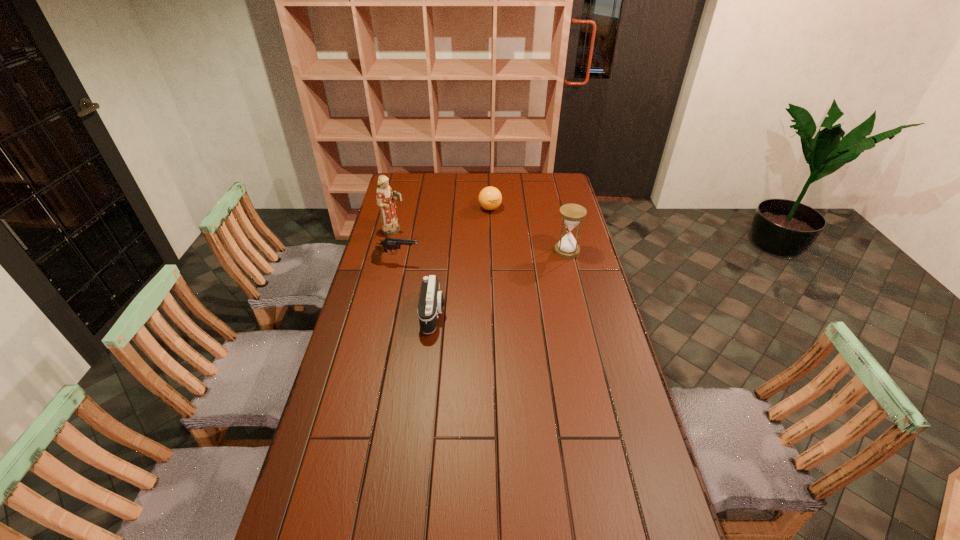
Where is `gun that is at the left edge`? The width and height of the screenshot is (960, 540). gun that is at the left edge is located at coordinates (389, 243).

Locate an element on the screen. The width and height of the screenshot is (960, 540). figurine located in the left edge section of the desktop is located at coordinates (385, 199).

Where is `object at the right edge`? This screenshot has height=540, width=960. object at the right edge is located at coordinates (572, 214).

Locate an element on the screen. This screenshot has width=960, height=540. free space at the far edge of the desktop is located at coordinates (527, 190).

The height and width of the screenshot is (540, 960). In the image, there is a desktop. Find the location of `blank space at the near edge`. blank space at the near edge is located at coordinates (447, 522).

Locate an element on the screen. vacant space at the left edge of the desktop is located at coordinates (396, 255).

Identify the location of free space at the right edge of the desktop. The height and width of the screenshot is (540, 960). (576, 285).

Where is `vacant position at the far left corner of the desktop`? Image resolution: width=960 pixels, height=540 pixels. vacant position at the far left corner of the desktop is located at coordinates (408, 191).

At what (x,y) coordinates should I click in order to perform the action: click on vacant region at the far right corner of the desktop. Please return your answer as a coordinate pair (x, y). Looking at the image, I should click on (543, 179).

The image size is (960, 540). What are the coordinates of `free space between the farthest object and the rightmost object` in the screenshot? It's located at (529, 230).